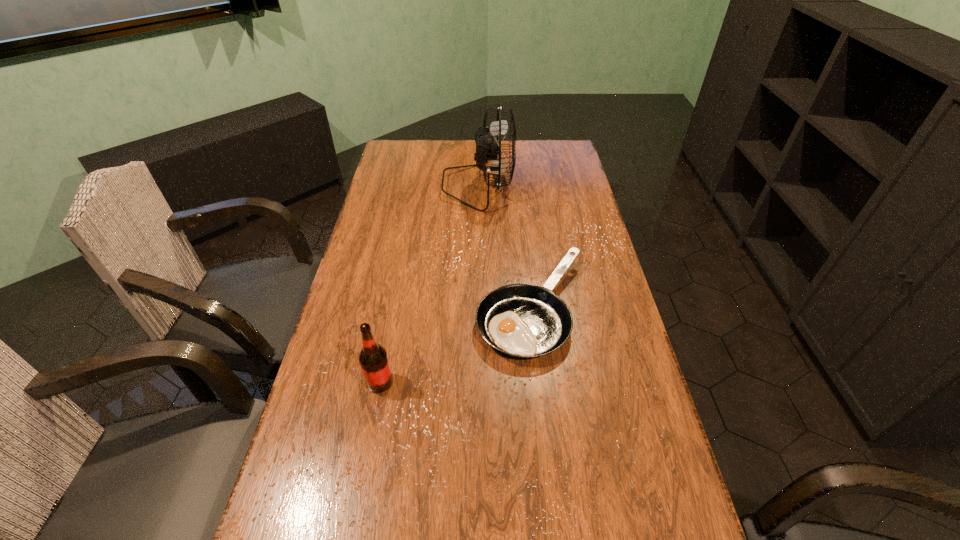
Point out which object is positioned as the second nearest to the farthest object. Please provide its 2D coordinates. Your answer should be formatted as a tuple, i.e. [(x, y)], where the tuple contains the x and y coordinates of a point satisfying the conditions above.

[(373, 358)]

You are a GUI agent. You are given a task and a screenshot of the screen. Output one action in this format:
    pyautogui.click(x=<x>, y=<y>)
    Task: Click on the closest object to the frying pan
    Image resolution: width=960 pixels, height=540 pixels.
    Given the screenshot: What is the action you would take?
    pyautogui.click(x=373, y=358)

This screenshot has height=540, width=960. I want to click on vacant space that satisfies the following two spatial constraints: 1. in front of the tallest object, directing airflow; 2. on the back side of the frying pan, so click(x=477, y=308).

You are a GUI agent. You are given a task and a screenshot of the screen. Output one action in this format:
    pyautogui.click(x=<x>, y=<y>)
    Task: Click on the vacant region that satisfies the following two spatial constraints: 1. in front of the tallest object, directing airflow; 2. on the back side of the second nearest object
    This screenshot has height=540, width=960.
    Given the screenshot: What is the action you would take?
    pyautogui.click(x=477, y=308)

Where is `free space in the image that satisfies the following two spatial constraints: 1. in front of the farthest object, directing airflow; 2. on the front side of the nearest object`? This screenshot has height=540, width=960. free space in the image that satisfies the following two spatial constraints: 1. in front of the farthest object, directing airflow; 2. on the front side of the nearest object is located at coordinates (476, 382).